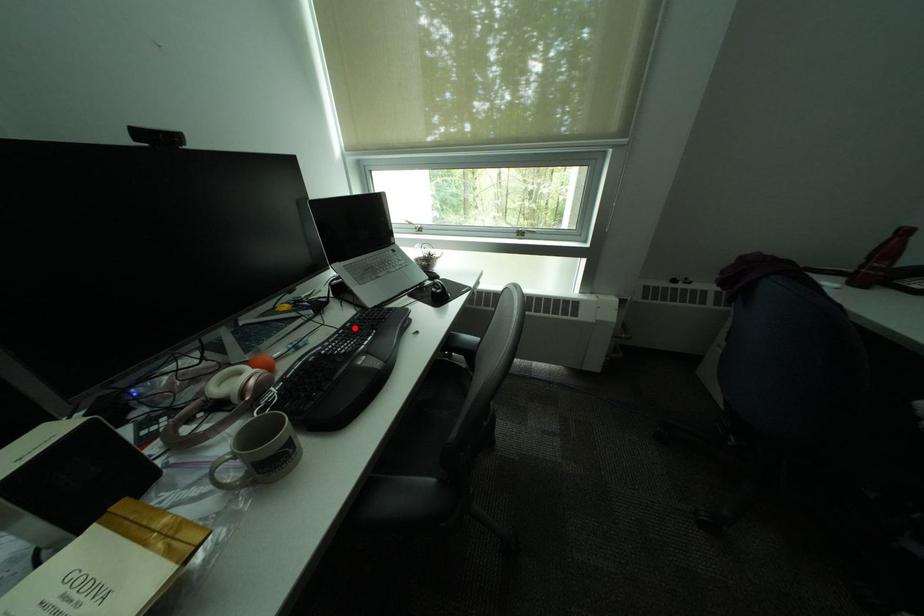
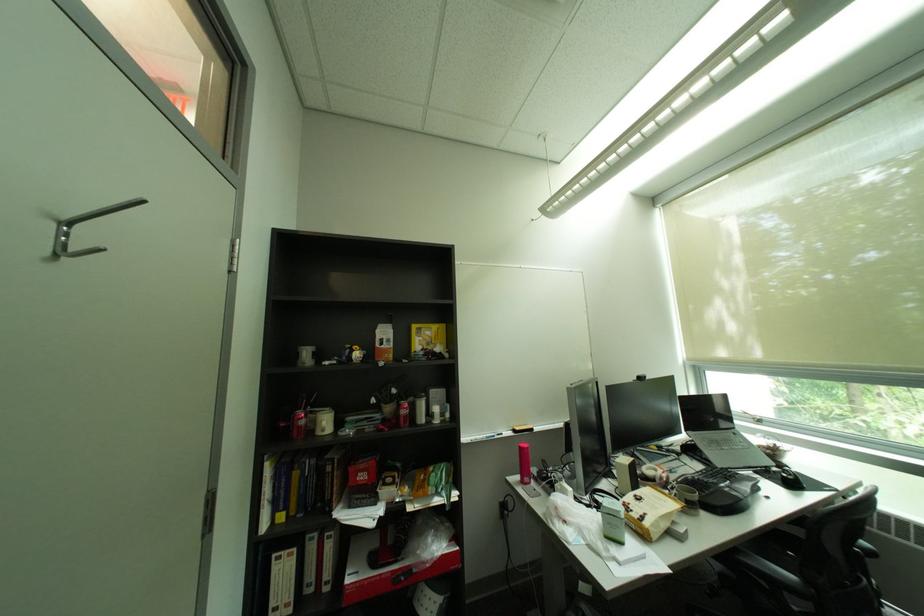
Find the pixel in the second image that matches the highlighted location in the first image.

(712, 472)